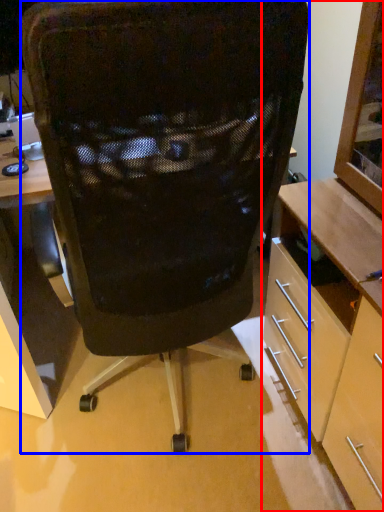
Question: Which of the following is the closest to the observer, cabinetry (highlighted by a red box) or chair (highlighted by a blue box)?

Choices:
 (A) cabinetry
 (B) chair

Answer: (A)